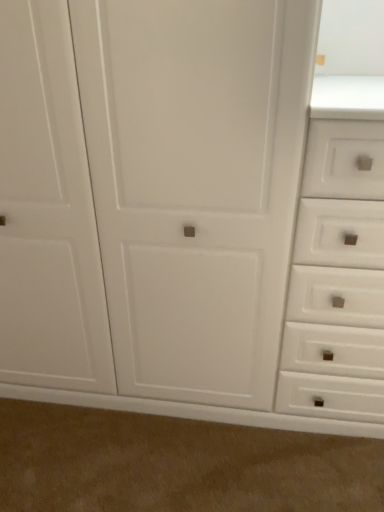
Question: Is beige carpet at lower center thinner than white matte drawer at right?

Choices:
 (A) yes
 (B) no

Answer: (A)

Question: From the image's perspective, is beige carpet at lower center below white matte drawer at right?

Choices:
 (A) yes
 (B) no

Answer: (A)

Question: Is beige carpet at lower center wider than white matte drawer at right?

Choices:
 (A) yes
 (B) no

Answer: (B)

Question: Can you confirm if beige carpet at lower center is shorter than white matte drawer at right?

Choices:
 (A) yes
 (B) no

Answer: (A)

Question: From a real-world perspective, is beige carpet at lower center beneath white matte drawer at right?

Choices:
 (A) yes
 (B) no

Answer: (A)

Question: Is beige carpet at lower center turned away from white matte drawer at right?

Choices:
 (A) yes
 (B) no

Answer: (B)

Question: Is white matte drawer at right completely or partially outside of beige carpet at lower center?

Choices:
 (A) no
 (B) yes

Answer: (B)

Question: Does white matte drawer at right have a greater height compared to beige carpet at lower center?

Choices:
 (A) yes
 (B) no

Answer: (A)

Question: Is beige carpet at lower center completely or partially inside white matte drawer at right?

Choices:
 (A) no
 (B) yes

Answer: (A)

Question: Considering the relative sizes of white matte drawer at right and beige carpet at lower center in the image provided, is white matte drawer at right bigger than beige carpet at lower center?

Choices:
 (A) no
 (B) yes

Answer: (B)

Question: Is the surface of white matte drawer at right in direct contact with beige carpet at lower center?

Choices:
 (A) no
 (B) yes

Answer: (A)

Question: Is white matte drawer at right looking in the opposite direction of beige carpet at lower center?

Choices:
 (A) yes
 (B) no

Answer: (B)

Question: From a real-world perspective, relative to white matte drawer at right, is beige carpet at lower center vertically above or below?

Choices:
 (A) above
 (B) below

Answer: (B)